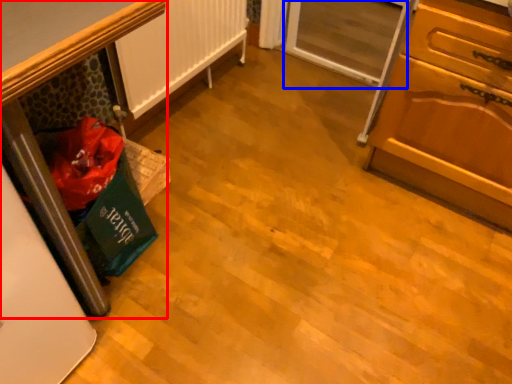
Question: Which object appears farthest to the camera in this image, furniture (highlighted by a red box) or screen door (highlighted by a blue box)?

Choices:
 (A) furniture
 (B) screen door

Answer: (B)